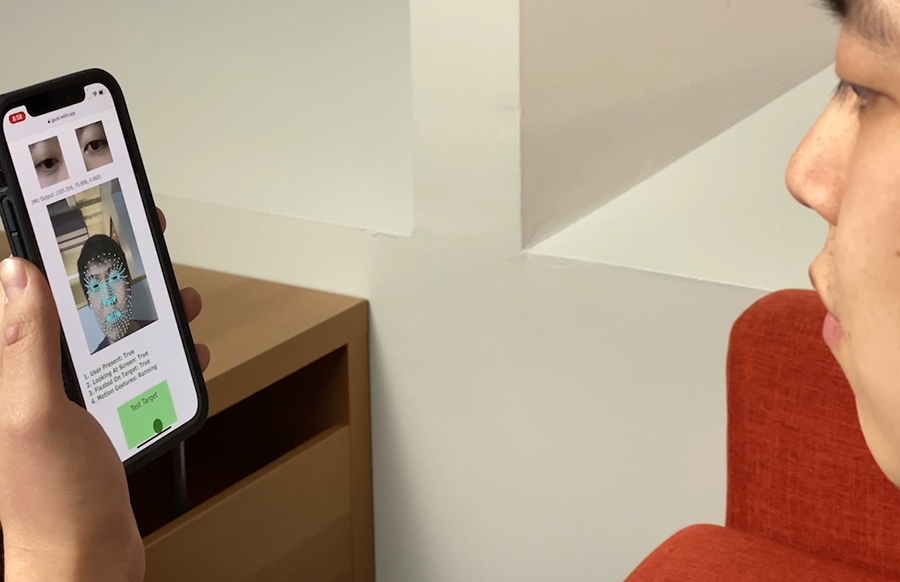
Find the location of a particular element. The width and height of the screenshot is (900, 582). side table is located at coordinates (256, 336).